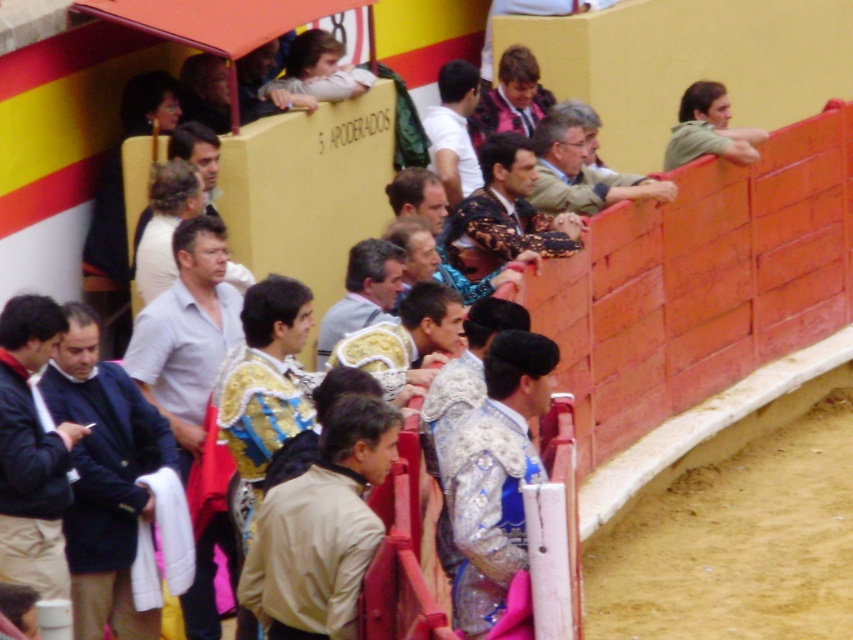
You are a photographer positioned at the arena entrance. You want to take a photo of both the white shirt at center and the matte beige blazer at upper center without any obstruction. Which subject should you adjust your camera angle to focus on first to ensure both are visible?

The white shirt at center is in front of the matte beige blazer at upper center, so you should adjust your camera angle to focus on the matte beige blazer at upper center first to ensure it is not blocked by the white shirt at center.

You are a photographer trying to capture both the light brown leather jacket at center and the gold embroidered suit at center in a single frame. Given their widths, which object should you position closer to the camera to ensure both fit in the shot?

Since the light brown leather jacket at center is narrower than the gold embroidered suit at center, you should position the gold embroidered suit at center closer to the camera to accommodate its wider size within the frame.